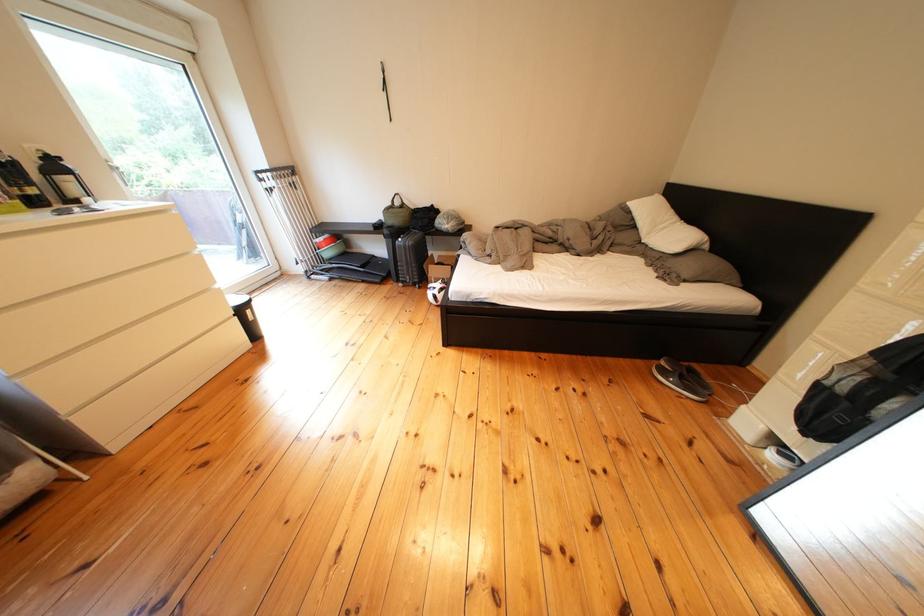
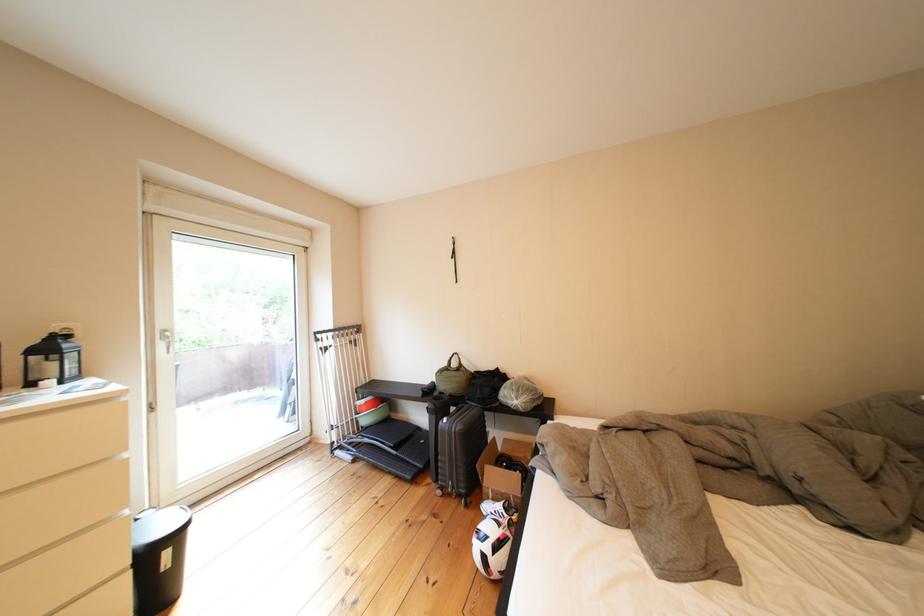
Find the pixel in the second image that matches [405,245] in the first image.

(448, 422)